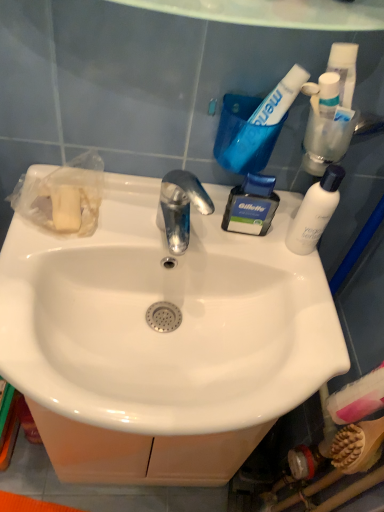
Question: Does white matte bottle at upper right come in front of clear plastic tube at upper right, the second toiletry in the left-to-right sequence?

Choices:
 (A) yes
 (B) no

Answer: (A)

Question: Is white matte bottle at upper right shorter than clear plastic tube at upper right, the second toiletry in the left-to-right sequence?

Choices:
 (A) no
 (B) yes

Answer: (A)

Question: Are white matte bottle at upper right and clear plastic tube at upper right, which is the third toiletry in bottom-to-top order, far apart?

Choices:
 (A) no
 (B) yes

Answer: (A)

Question: Is white matte bottle at upper right outside of clear plastic tube at upper right, placed as the first toiletry when sorted from top to bottom?

Choices:
 (A) yes
 (B) no

Answer: (A)

Question: Can you confirm if white matte bottle at upper right is wider than clear plastic tube at upper right, marked as the 2th toiletry in a right-to-left arrangement?

Choices:
 (A) no
 (B) yes

Answer: (A)

Question: Is pink matte toothbrush at lower right, the first toiletry viewed from the right, inside the boundaries of white glossy sink at center, or outside?

Choices:
 (A) outside
 (B) inside

Answer: (A)

Question: Considering the relative positions of pink matte toothbrush at lower right, the 3th toiletry from the left, and white glossy sink at center in the image provided, is pink matte toothbrush at lower right, the 3th toiletry from the left, to the left or to the right of white glossy sink at center?

Choices:
 (A) right
 (B) left

Answer: (A)

Question: Is pink matte toothbrush at lower right, the 3th toiletry from the left, taller or shorter than white glossy sink at center?

Choices:
 (A) short
 (B) tall

Answer: (B)

Question: From a real-world perspective, is pink matte toothbrush at lower right, marked as the third toiletry in a top-to-bottom arrangement, positioned above or below white glossy sink at center?

Choices:
 (A) below
 (B) above

Answer: (A)

Question: Considering the relative positions of white glossy toothpaste at upper right and pink matte toothbrush at lower right, the 3th toiletry from the left, in the image provided, is white glossy toothpaste at upper right to the left or to the right of pink matte toothbrush at lower right, the 3th toiletry from the left,?

Choices:
 (A) left
 (B) right

Answer: (A)

Question: Is white glossy toothpaste at upper right taller or shorter than pink matte toothbrush at lower right, the first toiletry viewed from the right?

Choices:
 (A) tall
 (B) short

Answer: (A)

Question: Relative to pink matte toothbrush at lower right, the 3th toiletry from the left, is white glossy toothpaste at upper right in front or behind?

Choices:
 (A) behind
 (B) front

Answer: (B)

Question: Is white glossy toothpaste at upper right wider or thinner than pink matte toothbrush at lower right, the first toiletry viewed from the right?

Choices:
 (A) wide
 (B) thin

Answer: (A)

Question: Is wooden bristles brush at lower right wider or thinner than white glossy toothpaste at upper right?

Choices:
 (A) wide
 (B) thin

Answer: (B)

Question: From a real-world perspective, is wooden bristles brush at lower right positioned above or below white glossy toothpaste at upper right?

Choices:
 (A) above
 (B) below

Answer: (B)